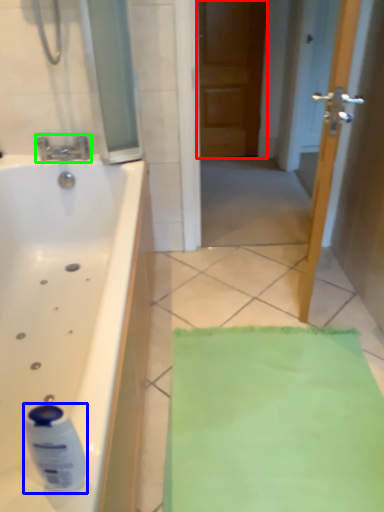
Question: Which object is the farthest from door (highlighted by a red box)? Choose among these: cleaning product (highlighted by a blue box) or tap (highlighted by a green box).

Choices:
 (A) cleaning product
 (B) tap

Answer: (A)